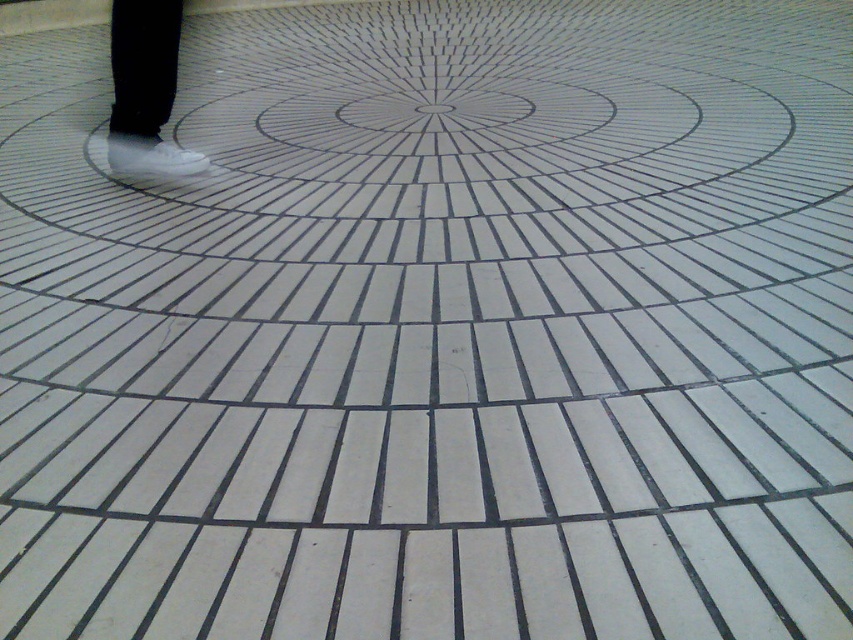
Question: Is white matte shoe at center below white matte shoe at left?

Choices:
 (A) no
 (B) yes

Answer: (A)

Question: Which point is closer to the camera taking this photo?

Choices:
 (A) (126, 28)
 (B) (181, 170)

Answer: (A)

Question: Is white matte shoe at center further to camera compared to white matte shoe at left?

Choices:
 (A) yes
 (B) no

Answer: (B)

Question: Which of the following is the farthest from the observer?

Choices:
 (A) (108, 141)
 (B) (138, 77)

Answer: (A)

Question: Does white matte shoe at center appear over white matte shoe at left?

Choices:
 (A) yes
 (B) no

Answer: (A)